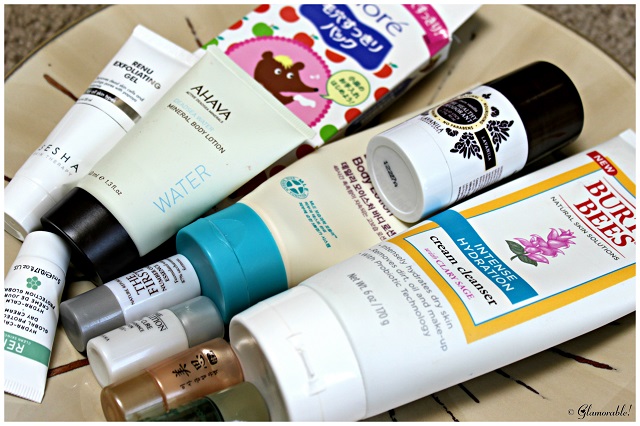
Find the location of a particular element. Image resolution: width=640 pixels, height=426 pixels. tube of body lotion is located at coordinates (188, 151), (372, 199).